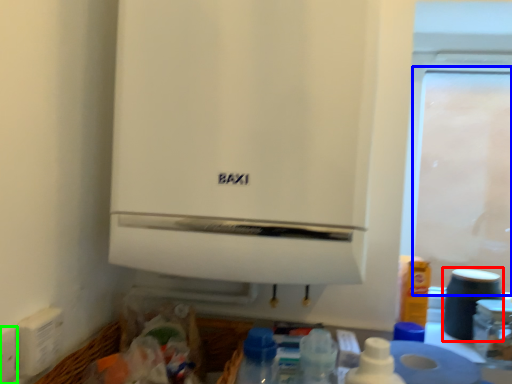
Question: Which object is positioned closest to appliance (highlighted by a red box)? Select from screen door (highlighted by a blue box) and electric outlet (highlighted by a green box).

Choices:
 (A) screen door
 (B) electric outlet

Answer: (B)